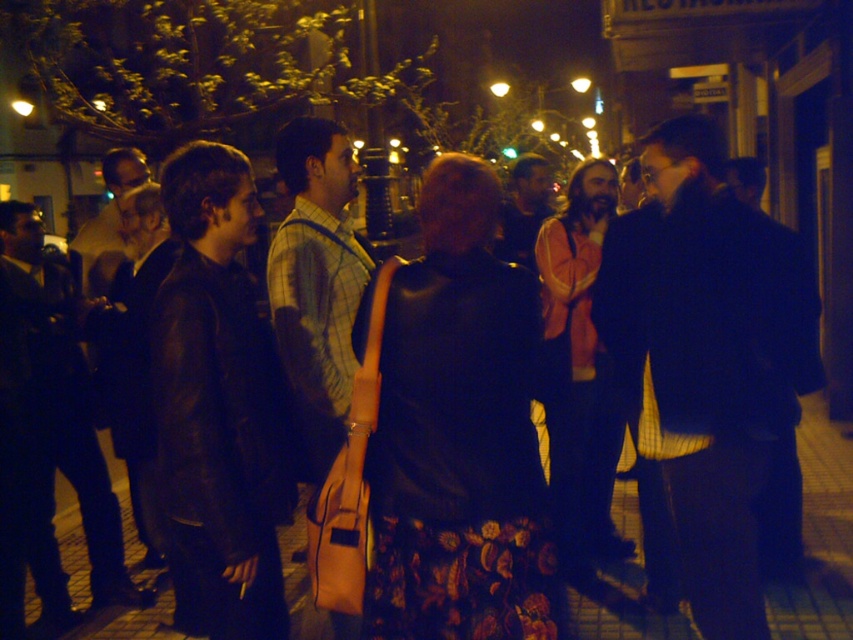
Question: Does leather jacket at left appear under dark brown leather jacket at left?

Choices:
 (A) yes
 (B) no

Answer: (B)

Question: Which object is closer to the camera taking this photo?

Choices:
 (A) dark blue jacket at center
 (B) plaid fabric shirt at center

Answer: (A)

Question: Does dark blue jacket at center have a larger size compared to dark brown leather jacket at left?

Choices:
 (A) yes
 (B) no

Answer: (B)

Question: Which object appears closest to the camera in this image?

Choices:
 (A) dark blue jacket at center
 (B) leather jacket at left

Answer: (B)

Question: Can you confirm if leather jacket at left is positioned below dark brown leather jacket at left?

Choices:
 (A) no
 (B) yes

Answer: (A)

Question: Which of the following is the farthest from the observer?

Choices:
 (A) plaid fabric shirt at center
 (B) dark blue jacket at center

Answer: (A)